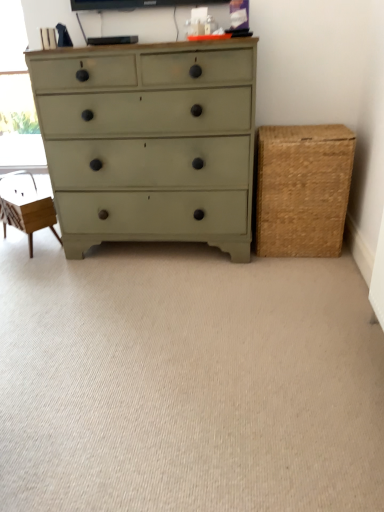
Locate an element on the screen. The width and height of the screenshot is (384, 512). free spot in front of braided wicker basket at right is located at coordinates (309, 272).